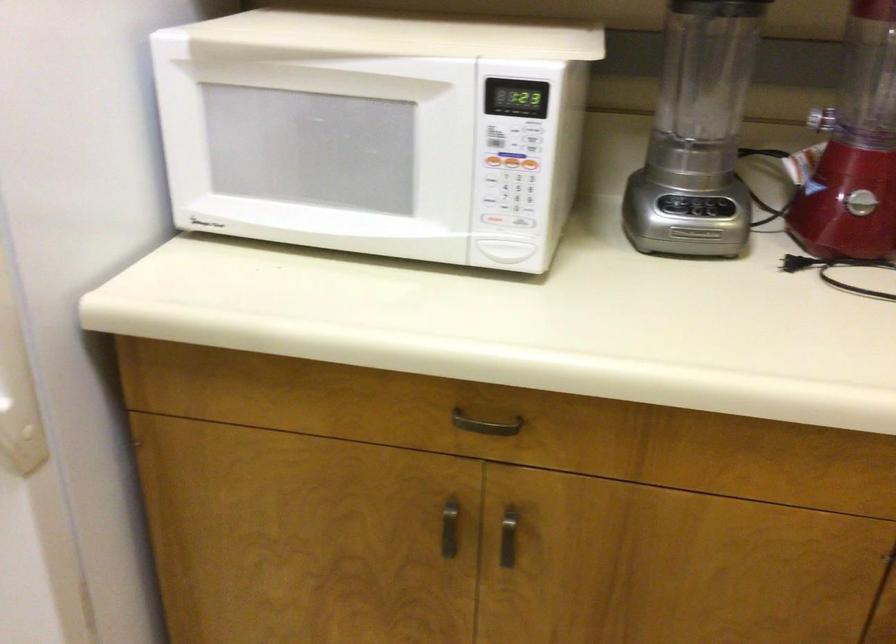
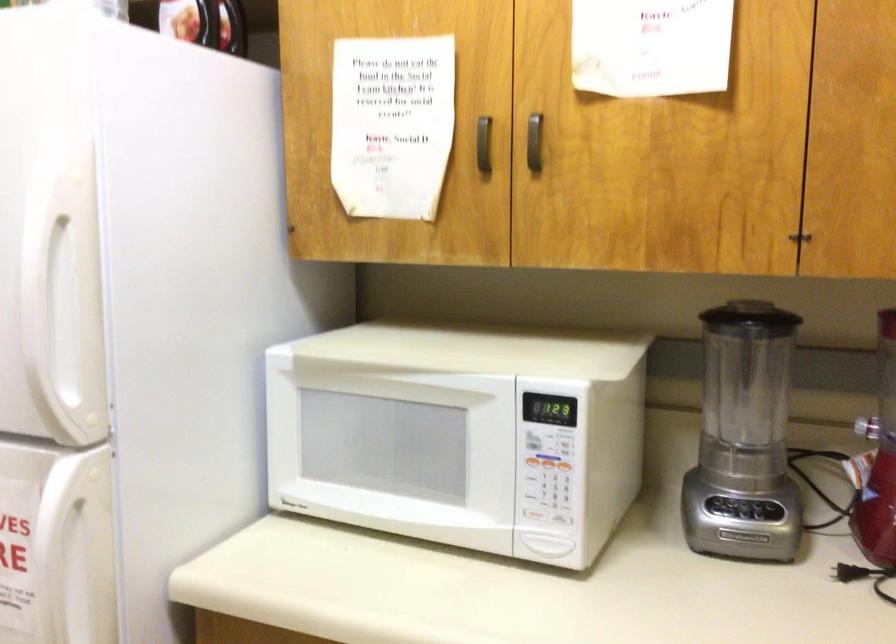
Find the pixel in the second image that matches (522,219) in the first image.

(563, 518)